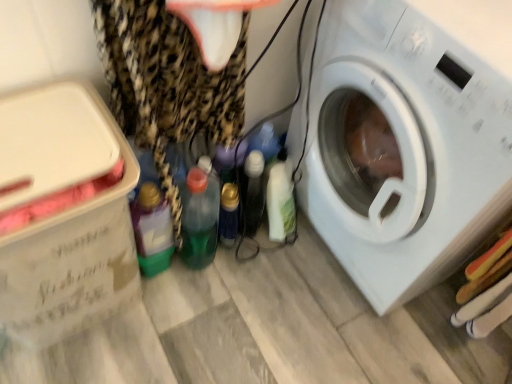
What do you see at coordinates (152, 230) in the screenshot?
I see `translucent green plastic bottle at lower left, the fourth bottle when ordered from right to left` at bounding box center [152, 230].

Measure the distance between white cardboard box at left and camera.

white cardboard box at left is 26.98 inches from camera.

This screenshot has width=512, height=384. Describe the element at coordinates (409, 139) in the screenshot. I see `white plastic washing machine at right` at that location.

Describe the element at coordinates (167, 84) in the screenshot. This screenshot has width=512, height=384. I see `leopard print fabric at left` at that location.

Measure the distance between point (206, 228) and camera.

Point (206, 228) and camera are 4.07 feet apart.

This screenshot has height=384, width=512. I want to click on green translucent bottle at center, the second bottle in the left-to-right sequence, so click(199, 218).

This screenshot has height=384, width=512. I want to click on translucent green plastic bottle at lower left, the fourth bottle when ordered from right to left, so click(x=152, y=230).

Considering the relative sizes of white cardboard box at left and white glossy bottle at center, which ranks as the fourth bottle in left-to-right order, in the image provided, is white cardboard box at left taller than white glossy bottle at center, which ranks as the fourth bottle in left-to-right order,?

Indeed, white cardboard box at left has a greater height compared to white glossy bottle at center, which ranks as the fourth bottle in left-to-right order.

Which bottle is the 4th one when counting from the back of the white cardboard box at left? Please provide its 2D coordinates.

[(280, 198)]

Is white cardboard box at left aimed at white glossy bottle at center, which ranks as the fourth bottle in left-to-right order?

No, white cardboard box at left does not turn towards white glossy bottle at center, which ranks as the fourth bottle in left-to-right order.

Which object is wider, white glossy bottle at center, marked as the first bottle in a right-to-left arrangement, or white cardboard box at left?

white cardboard box at left.

How many degrees apart are the facing directions of white glossy bottle at center, marked as the first bottle in a right-to-left arrangement, and white cardboard box at left?

The angle between the facing direction of white glossy bottle at center, marked as the first bottle in a right-to-left arrangement, and the facing direction of white cardboard box at left is 67.2 degrees.

From a real-world perspective, is white glossy bottle at center, which ranks as the fourth bottle in left-to-right order, below white cardboard box at left?

Yes, from a real-world perspective, white glossy bottle at center, which ranks as the fourth bottle in left-to-right order, is under white cardboard box at left.

Looking at this image, is white plastic washing machine at right at the left side of leopard print fabric at left?

No.

Is leopard print fabric at left inside white plastic washing machine at right?

No, leopard print fabric at left is located outside of white plastic washing machine at right.

Considering the sizes of objects white plastic washing machine at right and leopard print fabric at left in the image provided, who is smaller, white plastic washing machine at right or leopard print fabric at left?

Smaller between the two is leopard print fabric at left.

Can you tell me how much white plastic washing machine at right and leopard print fabric at left differ in facing direction?

The angle between the facing direction of white plastic washing machine at right and the facing direction of leopard print fabric at left is 89 degrees.

Does translucent green plastic bottle at lower left, the fourth bottle when ordered from right to left, have a lesser height compared to white plastic washing machine at right?

Yes, translucent green plastic bottle at lower left, the fourth bottle when ordered from right to left, is shorter than white plastic washing machine at right.

Image resolution: width=512 pixels, height=384 pixels. Find the location of `bottle that is the 1st object directly below the white plastic washing machine at right (from a real-world perspective)`. bottle that is the 1st object directly below the white plastic washing machine at right (from a real-world perspective) is located at coordinates (152, 230).

Is translucent green plastic bottle at lower left, which appears as the 1th bottle when viewed from the left, to the left of white plastic washing machine at right from the viewer's perspective?

Correct, you'll find translucent green plastic bottle at lower left, which appears as the 1th bottle when viewed from the left, to the left of white plastic washing machine at right.

Is translucent green plastic bottle at lower left, the fourth bottle when ordered from right to left, not within white plastic washing machine at right?

translucent green plastic bottle at lower left, the fourth bottle when ordered from right to left, lies outside white plastic washing machine at right's area.

From the picture: Can you tell me how much leopard print fabric at left and white glossy bottle at center, which ranks as the fourth bottle in left-to-right order, differ in facing direction?

70.5 degrees separate the facing orientations of leopard print fabric at left and white glossy bottle at center, which ranks as the fourth bottle in left-to-right order.

Who is smaller, leopard print fabric at left or white glossy bottle at center, which ranks as the fourth bottle in left-to-right order?

With smaller size is white glossy bottle at center, which ranks as the fourth bottle in left-to-right order.

Consider the image. Which object is further away from the camera taking this photo, leopard print fabric at left or white glossy bottle at center, marked as the first bottle in a right-to-left arrangement?

white glossy bottle at center, marked as the first bottle in a right-to-left arrangement, is further from the camera.

Is leopard print fabric at left not within white glossy bottle at center, which ranks as the fourth bottle in left-to-right order?

Yes, leopard print fabric at left is not within white glossy bottle at center, which ranks as the fourth bottle in left-to-right order.

From the image's perspective, is white plastic washing machine at right beneath green translucent bottle at center, the second bottle in the left-to-right sequence?

No.

How far apart are white plastic washing machine at right and green translucent bottle at center, the second bottle in the left-to-right sequence?

They are 18.27 inches apart.

Find the location of a particular element. The height and width of the screenshot is (384, 512). washing machine above the green translucent bottle at center, the second bottle in the left-to-right sequence (from a real-world perspective) is located at coordinates (409, 139).

From a real-world perspective, who is located lower, white plastic washing machine at right or green translucent bottle at center, the second bottle in the left-to-right sequence?

green translucent bottle at center, the second bottle in the left-to-right sequence.

From the image's perspective, which is below, white cardboard box at left or leopard print fabric at left?

white cardboard box at left is shown below in the image.

In terms of size, does white cardboard box at left appear bigger or smaller than leopard print fabric at left?

Considering their sizes, white cardboard box at left takes up more space than leopard print fabric at left.

In the scene shown: Is the surface of white cardboard box at left in direct contact with leopard print fabric at left?

No, white cardboard box at left is not with leopard print fabric at left.

Considering the positions of point (70, 317) and point (150, 57), is point (70, 317) closer or farther from the camera than point (150, 57)?

Point (70, 317) is positioned farther from the camera compared to point (150, 57).

Find the location of a particular element. Image resolution: width=512 pixels, height=384 pixels. bottle that is the 4th object located above the white cardboard box at left (from the image's perspective) is located at coordinates (280, 198).

This screenshot has width=512, height=384. In order to click on the 4th bottle behind the white cardboard box at left in this screenshot , I will do `click(280, 198)`.

Based on their spatial positions, is white glossy bottle at center, marked as the first bottle in a right-to-left arrangement, or green translucent bottle at center, the second bottle in the left-to-right sequence, further from white plastic washing machine at right?

Among the two, green translucent bottle at center, the second bottle in the left-to-right sequence, is located further to white plastic washing machine at right.

Considering their positions, is translucent green plastic bottle at lower left, which appears as the 1th bottle when viewed from the left, positioned further to green translucent bottle at center, the second bottle in the left-to-right sequence, than translucent plastic bottle at center, marked as the second bottle in a right-to-left arrangement?

The object further to green translucent bottle at center, the second bottle in the left-to-right sequence, is translucent green plastic bottle at lower left, which appears as the 1th bottle when viewed from the left.

Based on their spatial positions, is translucent plastic bottle at center, which appears as the 3th bottle when viewed from the left, or white plastic washing machine at right further from leopard print fabric at left?

Based on the image, white plastic washing machine at right appears to be further to leopard print fabric at left.

Based on their spatial positions, is green translucent bottle at center, the second bottle in the left-to-right sequence, or leopard print fabric at left closer to white glossy bottle at center, which ranks as the fourth bottle in left-to-right order?

green translucent bottle at center, the second bottle in the left-to-right sequence.

Which object lies further to the anchor point translucent green plastic bottle at lower left, the fourth bottle when ordered from right to left, white cardboard box at left or leopard print fabric at left?

white cardboard box at left is further to translucent green plastic bottle at lower left, the fourth bottle when ordered from right to left.

From the image, which object appears to be nearer to translucent plastic bottle at center, marked as the second bottle in a right-to-left arrangement, translucent green plastic bottle at lower left, the fourth bottle when ordered from right to left, or white cardboard box at left?

Based on the image, translucent green plastic bottle at lower left, the fourth bottle when ordered from right to left, appears to be nearer to translucent plastic bottle at center, marked as the second bottle in a right-to-left arrangement.

From the image, which object appears to be nearer to leopard print fabric at left, white cardboard box at left or translucent plastic bottle at center, which appears as the 3th bottle when viewed from the left?

white cardboard box at left is closer to leopard print fabric at left.

Which object lies nearer to the anchor point white plastic washing machine at right, white glossy bottle at center, marked as the first bottle in a right-to-left arrangement, or translucent green plastic bottle at lower left, the fourth bottle when ordered from right to left?

white glossy bottle at center, marked as the first bottle in a right-to-left arrangement.

This screenshot has width=512, height=384. I want to click on bottle positioned between translucent green plastic bottle at lower left, the fourth bottle when ordered from right to left, and translucent plastic bottle at center, which appears as the 3th bottle when viewed from the left, from near to far, so click(x=199, y=218).

Image resolution: width=512 pixels, height=384 pixels. In order to click on bottle located between leopard print fabric at left and green translucent bottle at center, which is the third bottle in right-to-left order, in the depth direction in this screenshot , I will do `click(152, 230)`.

Locate an element on the screen. This screenshot has height=384, width=512. cardboard box between leopard print fabric at left and translucent plastic bottle at center, marked as the second bottle in a right-to-left arrangement, in the front-back direction is located at coordinates (63, 212).

Find the location of a particular element. bottle between white cardboard box at left and green translucent bottle at center, which is the third bottle in right-to-left order, from front to back is located at coordinates (152, 230).